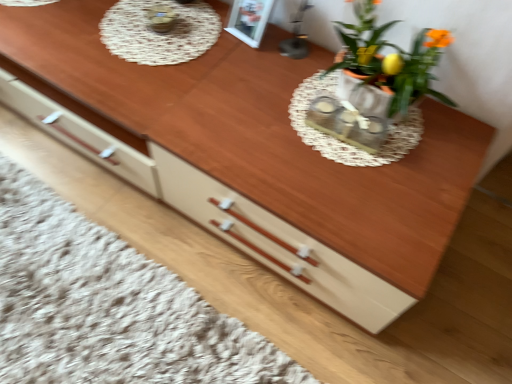
At what (x,y) coordinates should I click in order to perform the action: click on vacant space in between matte white flowerpot at upper right and white lace doily at upper center. Please return your answer as a coordinate pair (x, y). Looking at the image, I should click on (243, 74).